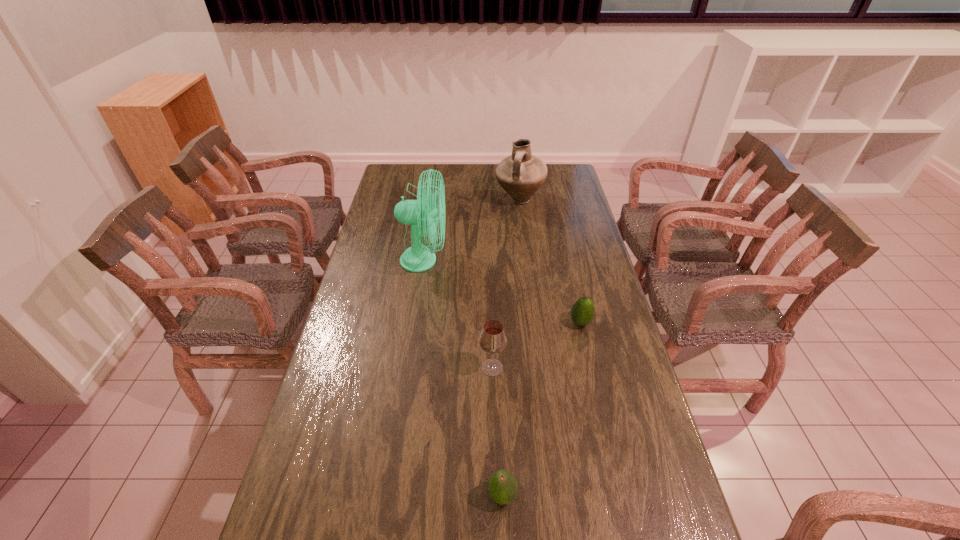
The image size is (960, 540). Find the location of `free location that satisfies the following two spatial constraints: 1. on the handle side of the fourth shortest object; 2. on the right side of the rightmost object`. free location that satisfies the following two spatial constraints: 1. on the handle side of the fourth shortest object; 2. on the right side of the rightmost object is located at coordinates (535, 322).